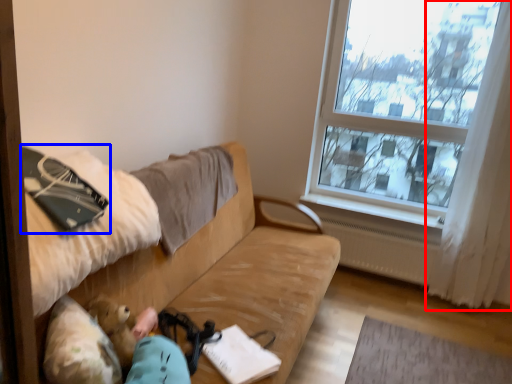
Question: Which object appears farthest to the camera in this image, curtain (highlighted by a red box) or notebook (highlighted by a blue box)?

Choices:
 (A) curtain
 (B) notebook

Answer: (A)